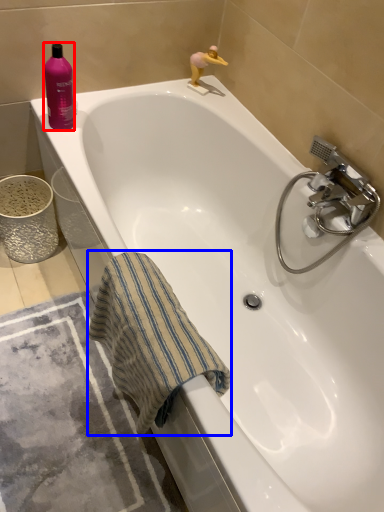
Question: Which object is further to the camera taking this photo, cleaning product (highlighted by a red box) or beach towel (highlighted by a blue box)?

Choices:
 (A) cleaning product
 (B) beach towel

Answer: (A)